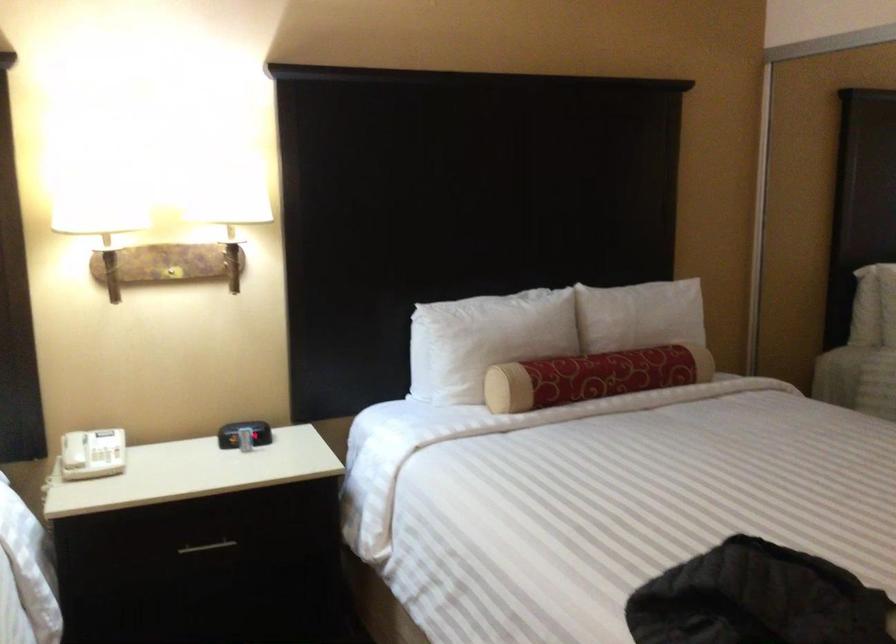
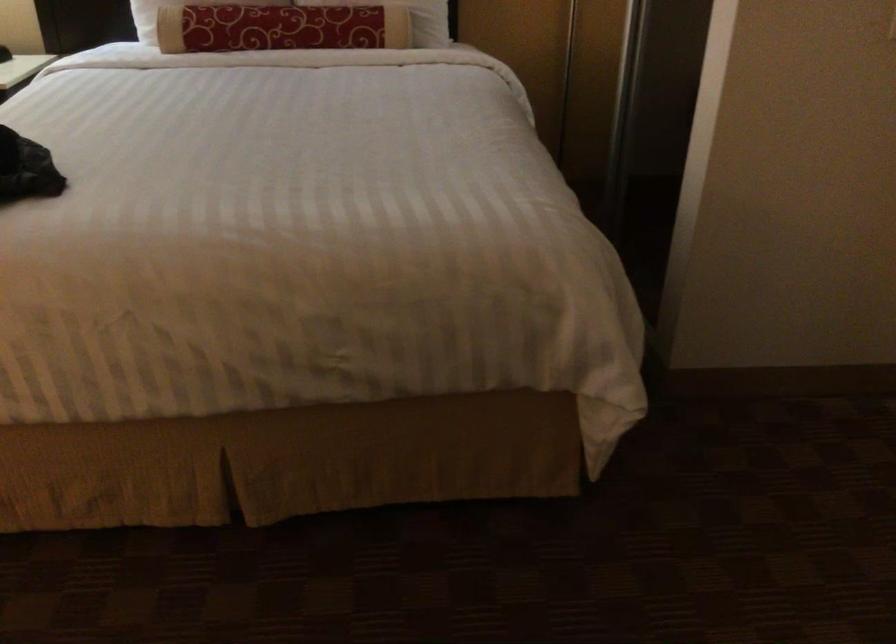
In the second image, find the point that corresponds to (x=615, y=371) in the first image.

(280, 28)